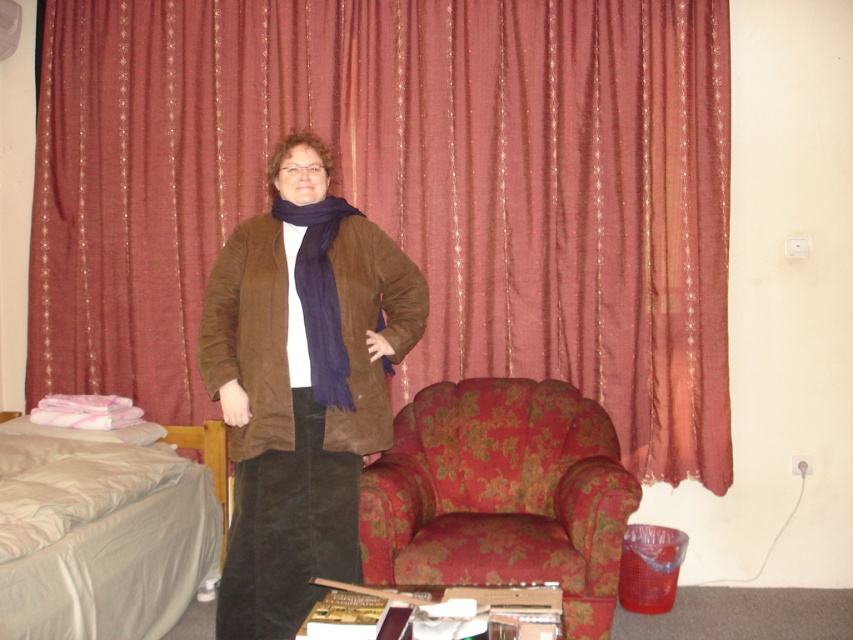
Question: Can you confirm if light gray fabric bed at lower left is bigger than dark blue silky scarf at center?

Choices:
 (A) no
 (B) yes

Answer: (B)

Question: Which object is the closest to the dark blue silky scarf at center?

Choices:
 (A) maroon fabric curtain at upper center
 (B) suede brown jacket at center
 (C) floral fabric armchair at lower center
 (D) light gray fabric bed at lower left

Answer: (B)

Question: Is floral fabric armchair at lower center to the left of light gray fabric bed at lower left from the viewer's perspective?

Choices:
 (A) yes
 (B) no

Answer: (B)

Question: In this image, where is maroon fabric curtain at upper center located relative to light gray fabric bed at lower left?

Choices:
 (A) right
 (B) left

Answer: (A)

Question: Which point appears closest to the camera in this image?

Choices:
 (A) (103, 522)
 (B) (337, 326)
 (C) (515, 563)

Answer: (B)

Question: Which point is farther to the camera?

Choices:
 (A) (328, 291)
 (B) (553, 145)

Answer: (B)